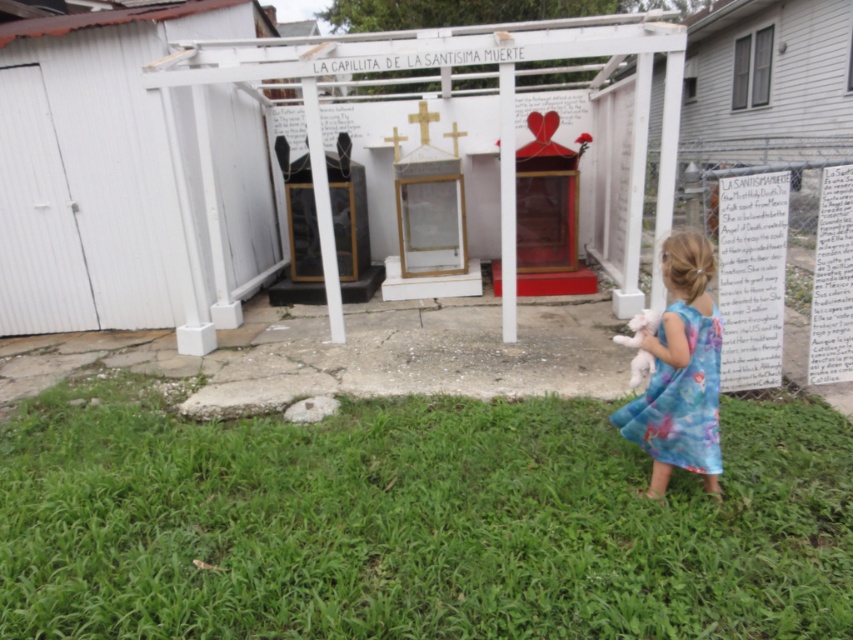
You are standing in front of the shrine and want to place a small offering on the green grass at lower center and the blue floral dress at lower right. Which object is closer to you where you can place the offering without moving your position?

The green grass at lower center is closer to the viewer than the blue floral dress at lower right, so you can place the offering on the green grass at lower center without moving your position.

In the scene shown: You are a photographer standing in front of the shrine and want to capture both the green grass at lower center and the blue floral dress at lower right in your photo. Which object will appear taller in the final image?

The blue floral dress at lower right will appear taller in the photo since the green grass at lower center is shorter than it.